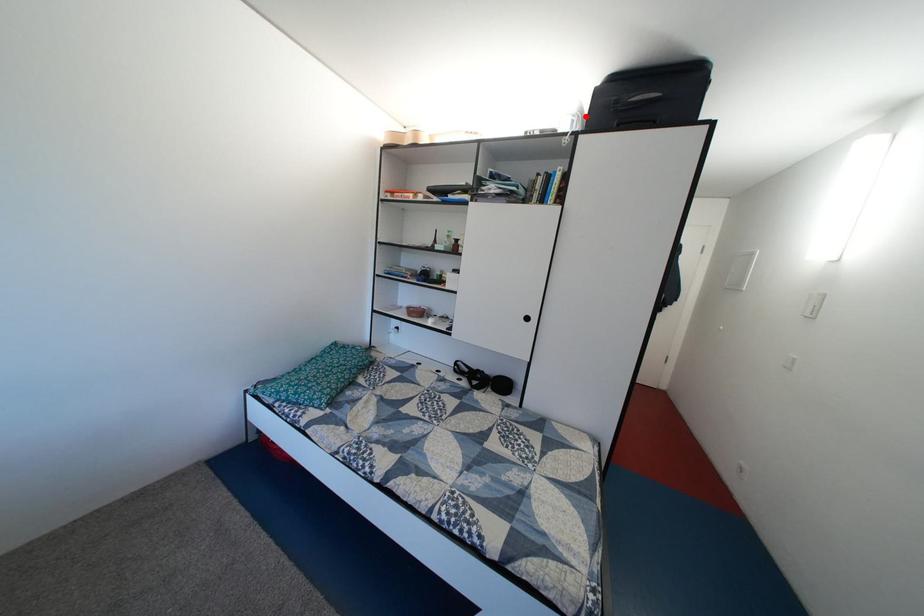
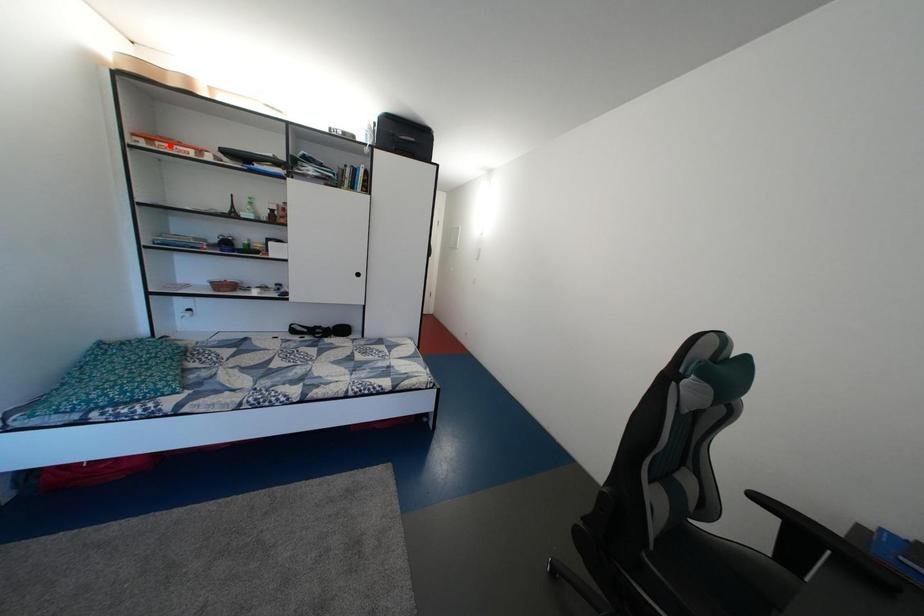
I am providing you with two images of the same scene from different viewpoints. A red point is marked on the first image and another point is marked on the second image. Do the highlighted points in image1 and image2 indicate the same real-world spot?

No